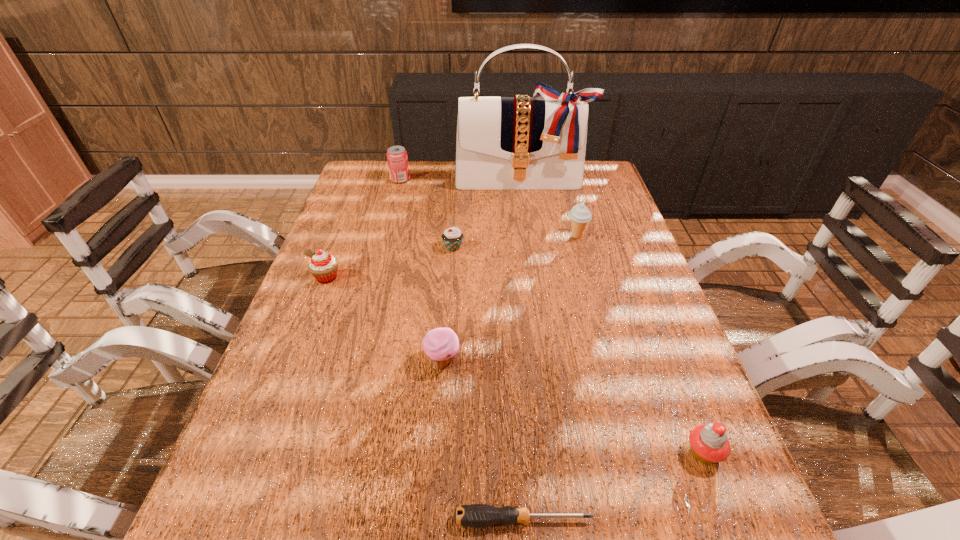
Find the location of a particular element. free region at the near edge of the desktop is located at coordinates (348, 527).

Image resolution: width=960 pixels, height=540 pixels. I want to click on free spot at the left edge of the desktop, so click(302, 517).

I want to click on vacant space at the right edge of the desktop, so click(672, 373).

Locate an element on the screen. vacant area that lies between the soda can and the farthest cupcake is located at coordinates (426, 213).

The image size is (960, 540). Identify the location of vacant space in between the icecream and the satchel. coord(549,208).

Where is `vacant area that lies between the second farthest cupcake and the farthest cupcake`? This screenshot has width=960, height=540. vacant area that lies between the second farthest cupcake and the farthest cupcake is located at coordinates (390, 262).

Image resolution: width=960 pixels, height=540 pixels. Identify the location of vacant area that lies between the rightmost cupcake and the second object from left to right. (552, 316).

This screenshot has width=960, height=540. Find the location of `vacant space that's between the tallest object and the icecream`. vacant space that's between the tallest object and the icecream is located at coordinates (549, 208).

This screenshot has height=540, width=960. What are the coordinates of `free space between the icecream and the farthest cupcake` in the screenshot? It's located at (515, 242).

Locate an element on the screen. empty space that is in between the seventh object from right to left and the farthest cupcake is located at coordinates (426, 213).